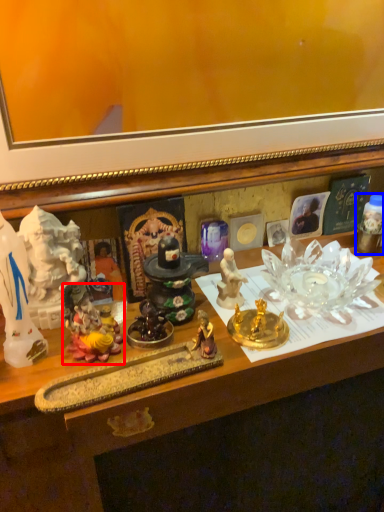
Question: Which of the following is the farthest to the observer, toy (highlighted by a red box) or toy (highlighted by a blue box)?

Choices:
 (A) toy
 (B) toy

Answer: (B)